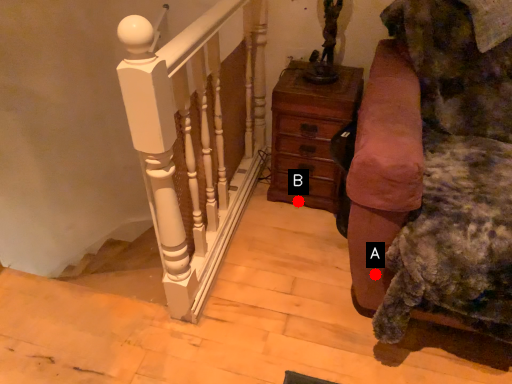
Question: Two points are circled on the image, labeled by A and B beside each circle. Which of the following is the farthest from the observer?

Choices:
 (A) A is further
 (B) B is further

Answer: (B)